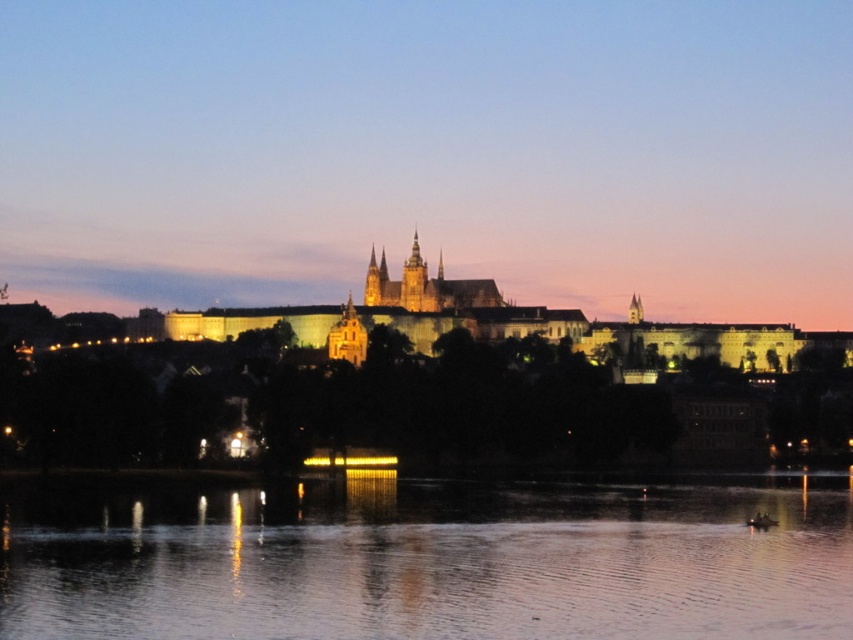
Is smooth reflective water at lower center wider than illuminated stone castle at center?

No, smooth reflective water at lower center is not wider than illuminated stone castle at center.

This screenshot has height=640, width=853. What do you see at coordinates (425, 563) in the screenshot?
I see `smooth reflective water at lower center` at bounding box center [425, 563].

Between point (821, 564) and point (428, 337), which one is positioned behind?

The point (428, 337) is more distant.

Locate an element on the screen. This screenshot has height=640, width=853. smooth reflective water at lower center is located at coordinates (425, 563).